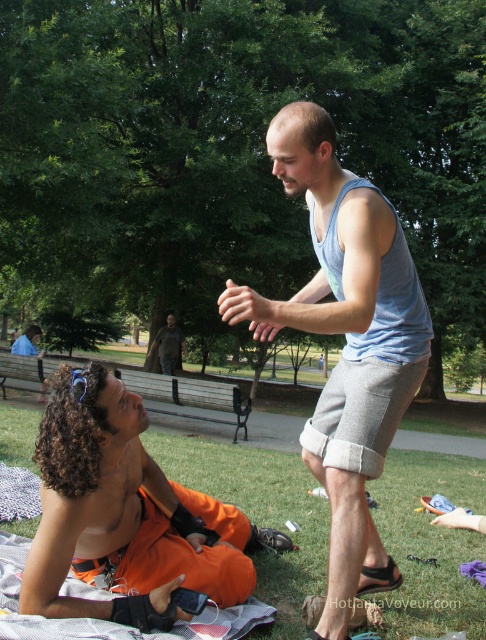
You are a photographer trying to capture a candid shot of the two people in the park. You notice the light blue tank top at center and the camouflage fabric jacket at center. Which clothing item is positioned higher on the person wearing them?

The light blue tank top at center is located above the camouflage fabric jacket at center, so it is positioned higher on the person wearing them.

Looking at this image, you are standing in the park and see the light blue tank top at center. If you want to reach it without moving your feet, can you do it?

The light blue tank top at center is 6.06 feet from viewer. Since the average person can reach about 2.5 to 3 feet in front of them, you cannot reach it without moving your feet.

Based on the photo, you are planning to take a photo of the orange fabric pants at lower left and the camouflage fabric jacket at center. Which object should you zoom in more on to ensure both are clearly visible in the frame?

The orange fabric pants at lower left is bigger than the camouflage fabric jacket at center, so you should zoom in more on the orange fabric pants at lower left to ensure both are clearly visible in the frame.